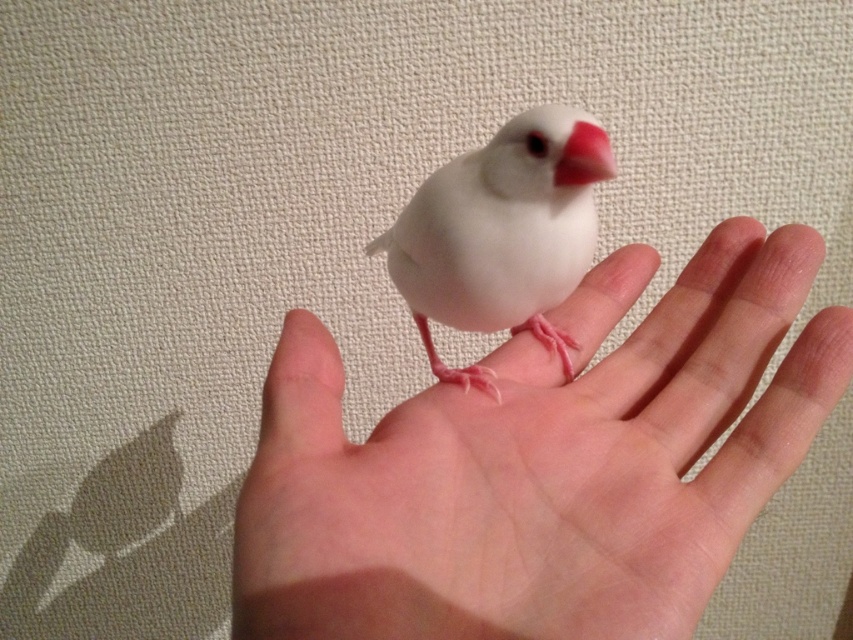
You are a photographer setting up a photo shoot. You need to position a light source to ensure the white matte bird at center is well lit while keeping the smooth skin palm at center in shadow. Based on the scene description, where should you place the light source relative to the bird and the palm?

To keep the smooth skin palm at center in shadow while lighting the white matte bird at center, place the light source above the bird. Since the palm is below the bird, positioning the light above will cast the palm into shadow while illuminating the bird.

You are a photographer trying to capture the bird on the smooth skin palm at center. To ensure the bird stays in frame, where should you focus your camera? Please provide coordinates in the format of x,y.

The smooth skin palm at center is located at coordinates (540,468), so you should focus your camera there to keep the bird in frame.